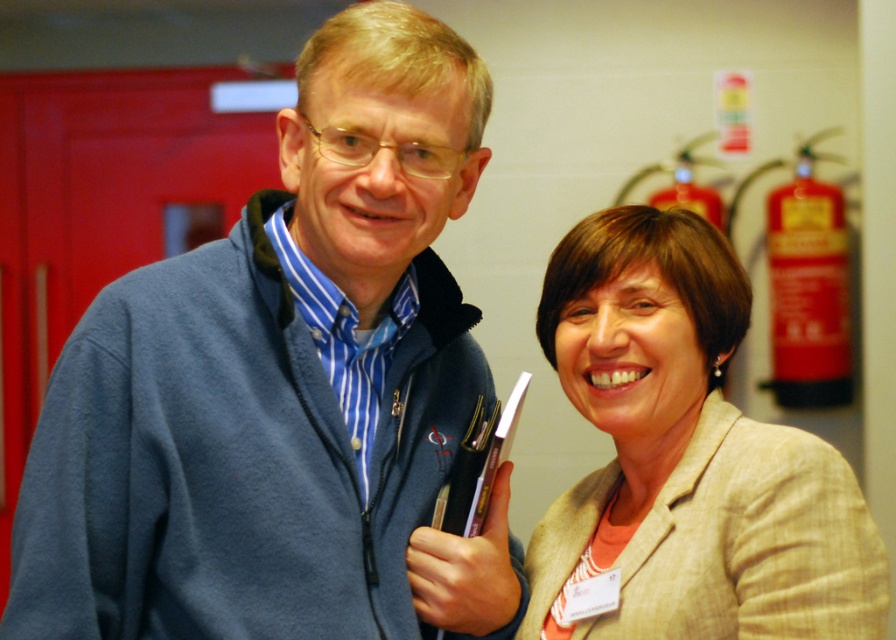
Question: Is blue fleece jacket at left below beige textured blazer at right?

Choices:
 (A) yes
 (B) no

Answer: (B)

Question: Is blue fleece jacket at left wider than beige textured blazer at right?

Choices:
 (A) no
 (B) yes

Answer: (B)

Question: Which point is farther to the camera?

Choices:
 (A) beige textured blazer at right
 (B) blue fleece jacket at left

Answer: (A)

Question: From the image, what is the correct spatial relationship of blue fleece jacket at left in relation to beige textured blazer at right?

Choices:
 (A) below
 (B) above

Answer: (B)

Question: Among these points, which one is farthest from the camera?

Choices:
 (A) (662, 259)
 (B) (11, 612)

Answer: (A)